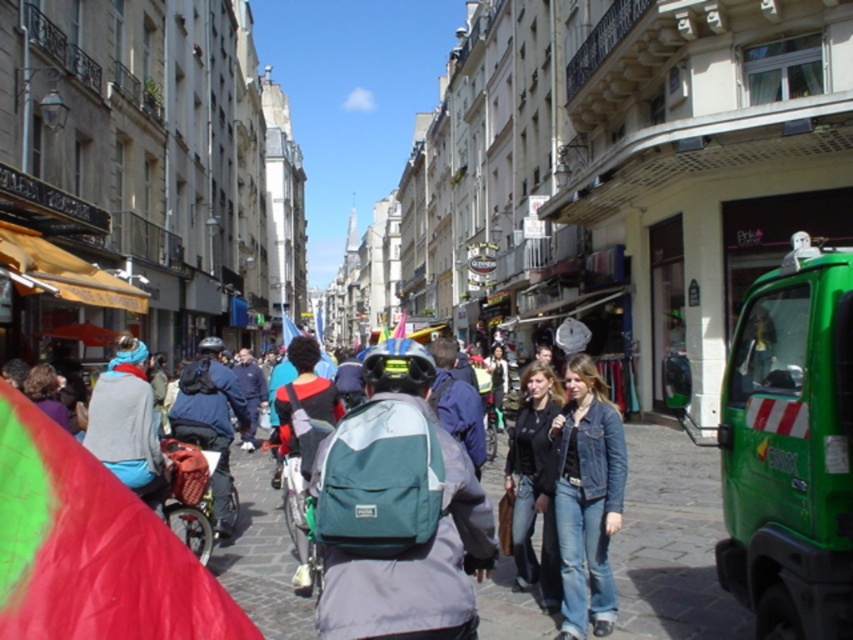
You are a traveler standing on the cobblestone street in the European city scene. You notice a denim jacket at center and jeans at center. Which piece of clothing is positioned more to the left?

The denim jacket at center is positioned to the left of jeans at center, so the denim jacket at center is more to the left.

You are standing at the center of the street in the European city scene. You want to find the green matte truck at right. Which direction should you look to locate it?

The green matte truck at right is located at the right side of the scene, so you should look to your right to find it.

You are a photographer planning to take a portrait of a person wearing both the denim jacket at center and jeans at center. Given the spatial relationship between the two items, what adjustment might you need to make to ensure both items are clearly visible in the frame?

The denim jacket at center is wider than the jeans at center, so you should position the person so that the denim jacket at center does not overlap or block the jeans at center, ensuring both are fully visible in the photograph.